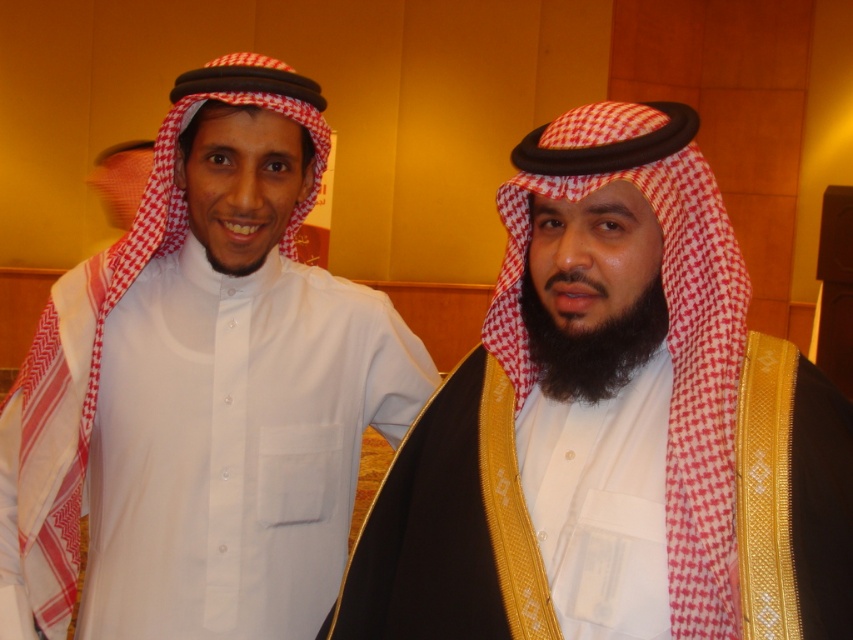
Does white fabric headscarf at right appear over white matte shirt at center?

Actually, white fabric headscarf at right is below white matte shirt at center.

Does white fabric headscarf at right appear on the right side of white matte shirt at center?

Correct, you'll find white fabric headscarf at right to the right of white matte shirt at center.

Where is `white fabric headscarf at right`? This screenshot has width=853, height=640. white fabric headscarf at right is located at coordinates (614, 426).

Locate an element on the screen. white fabric headscarf at right is located at coordinates (614, 426).